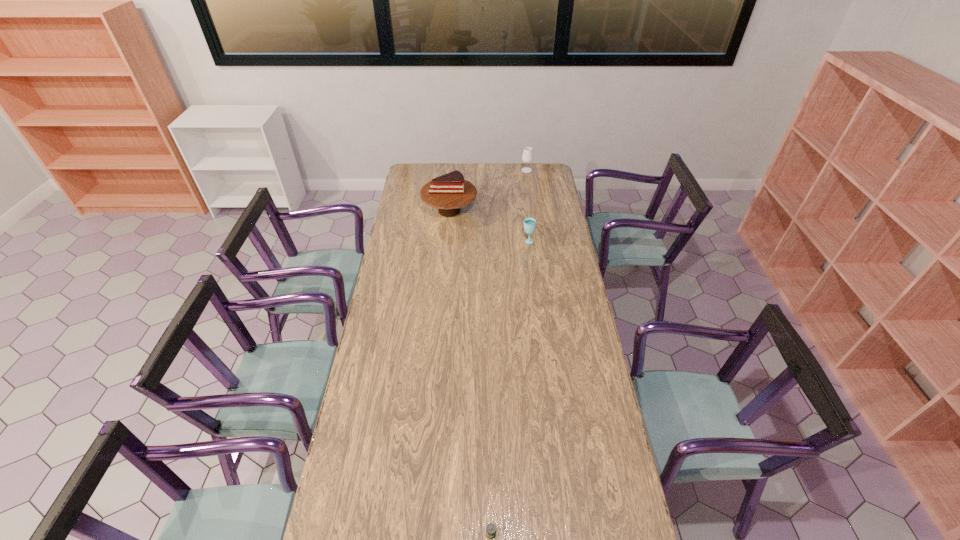
The height and width of the screenshot is (540, 960). In order to click on object present at the far right corner in this screenshot , I will do `click(527, 157)`.

Identify the location of vacant space at the far edge of the desktop. (521, 171).

Identify the location of vacant space at the left edge of the desktop. This screenshot has height=540, width=960. (391, 274).

Image resolution: width=960 pixels, height=540 pixels. I want to click on vacant area at the right edge of the desktop, so click(x=544, y=188).

Where is `vacant space that is in between the nearer glass and the tallest object`? The image size is (960, 540). vacant space that is in between the nearer glass and the tallest object is located at coordinates (489, 226).

Locate an element on the screen. free spot between the cake and the farthest object is located at coordinates (488, 190).

You are a GUI agent. You are given a task and a screenshot of the screen. Output one action in this format:
    pyautogui.click(x=<x>, y=<y>)
    Task: Click on the vacant space that is in between the farther glass and the cake
    This screenshot has height=540, width=960.
    Given the screenshot: What is the action you would take?
    pyautogui.click(x=488, y=190)

Locate an element on the screen. The image size is (960, 540). free spot between the third nearest object and the nearer glass is located at coordinates (489, 226).

Where is `object that ranks as the third closest to the farther glass`? The image size is (960, 540). object that ranks as the third closest to the farther glass is located at coordinates (491, 528).

Locate which object ranks second in proximity to the farther glass. Please provide its 2D coordinates. Your answer should be formatted as a tuple, i.e. [(x, y)], where the tuple contains the x and y coordinates of a point satisfying the conditions above.

[(529, 223)]